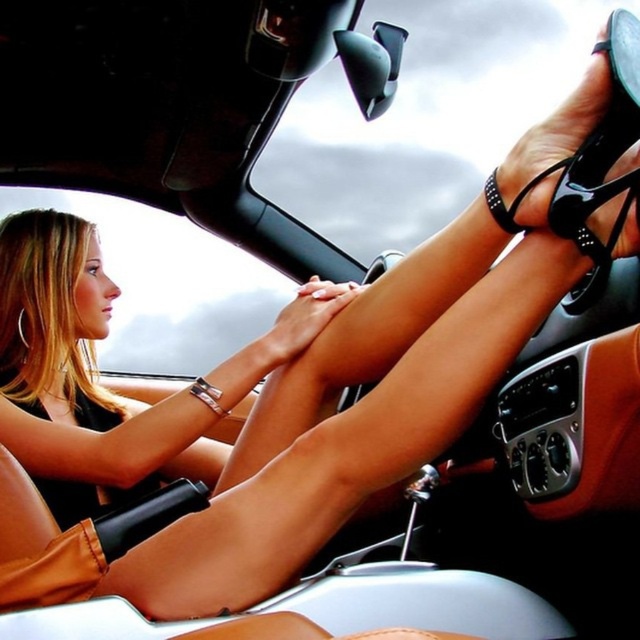
Based on the scene description, which object occupies more space in the image? The smooth skin legs at center or the black glossy shoe at center?

The smooth skin legs at center is larger in size than the black glossy shoe at center, so the smooth skin legs at center occupies more space in the image.

You are a car designer evaluating the interior space of this car. You need to determine if the smooth skin legs at center and the black glossy shoe at center can fit comfortably in the space between the dashboard and the steering wheel. Based on the description, can both objects fit without causing any discomfort?

The smooth skin legs at center might be wider than black glossy shoe at center, so there could be discomfort if both are placed in the confined space between the dashboard and steering wheel.